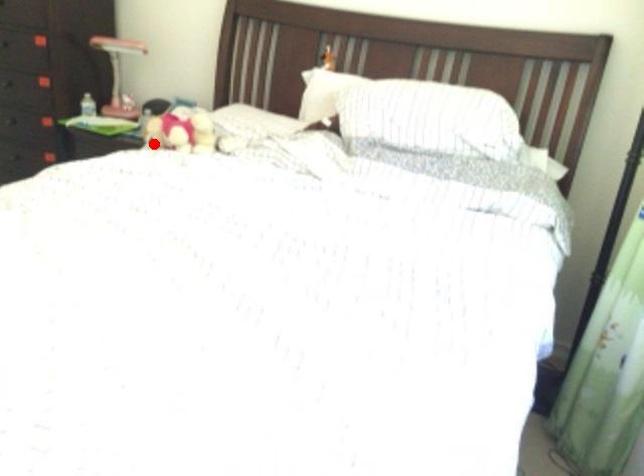
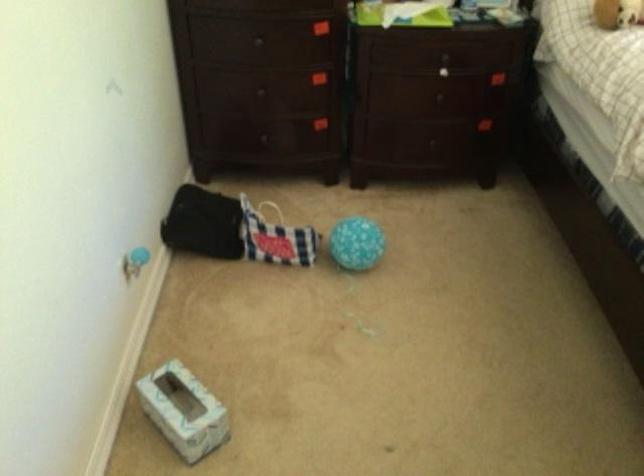
Find the pixel in the second image that matches the highlighted location in the first image.

(617, 13)